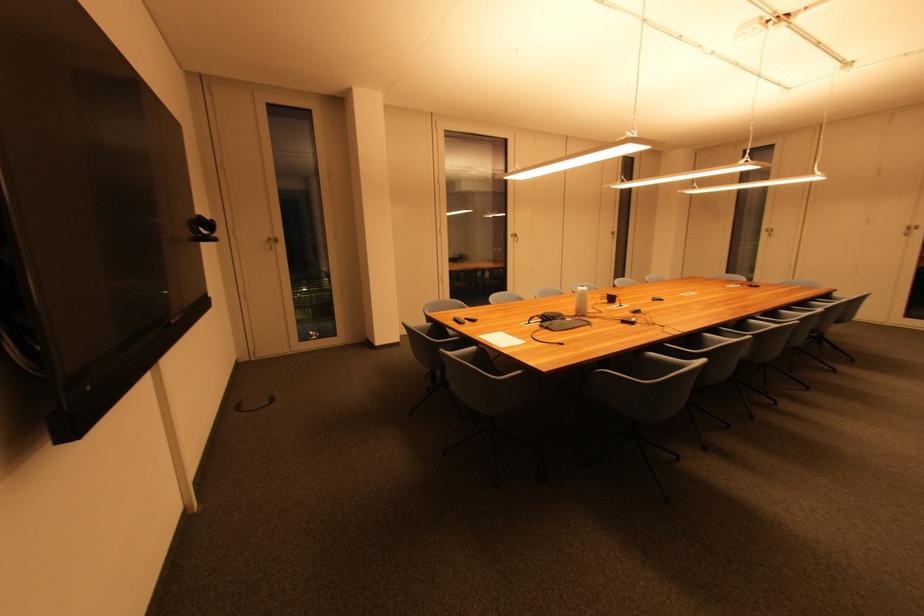
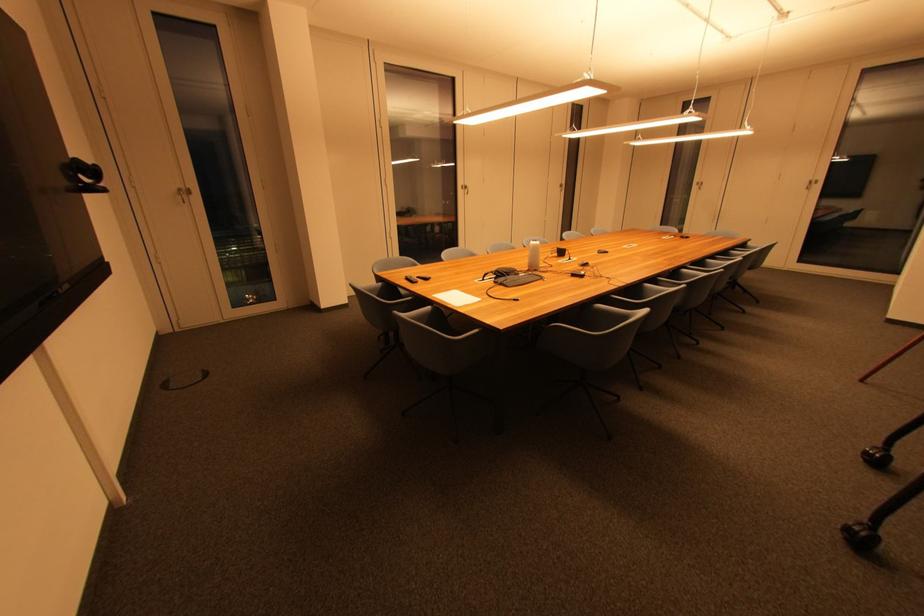
In the second image, find the point that corresponds to pixel 545 328 in the first image.

(500, 285)